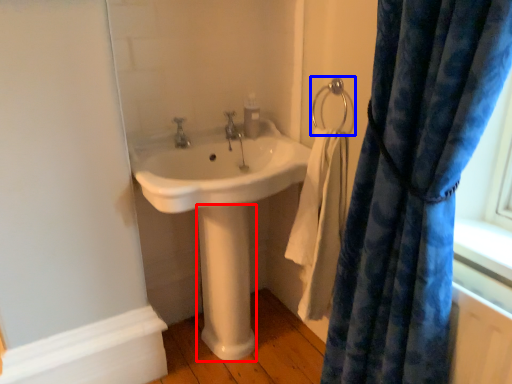
Question: Which point is further to the camera, pillar (highlighted by a red box) or shower (highlighted by a blue box)?

Choices:
 (A) pillar
 (B) shower

Answer: (A)